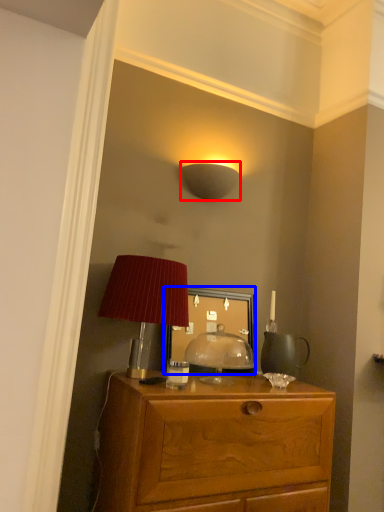
Question: Which object is closer to the camera taking this photo, lamp (highlighted by a red box) or mirror (highlighted by a blue box)?

Choices:
 (A) lamp
 (B) mirror

Answer: (B)